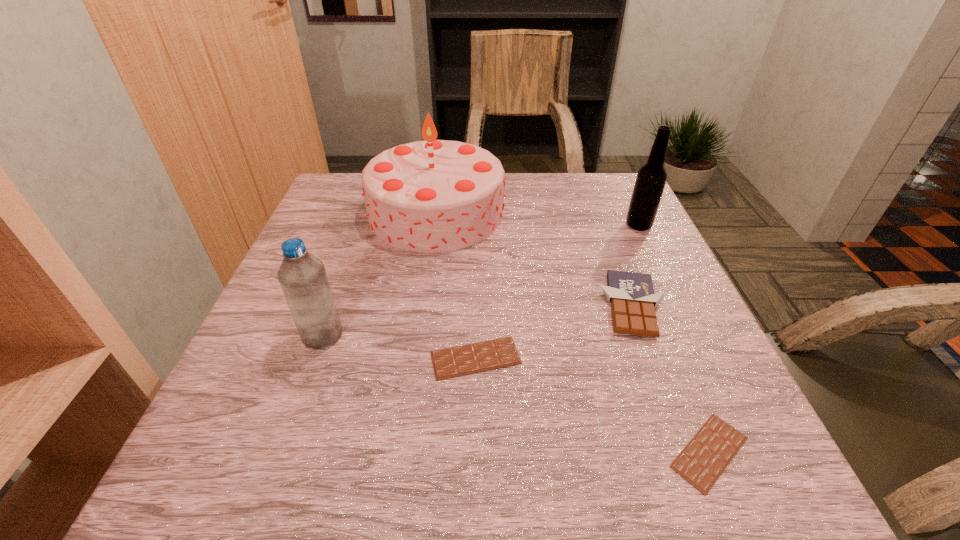
At what (x,y) coordinates should I click in order to perform the action: click on vacant area that lies between the nearest object and the tallest chocolate bar. Please return your answer as a coordinate pair (x, y). Looking at the image, I should click on (671, 379).

Locate an element on the screen. The height and width of the screenshot is (540, 960). free space between the fourth tallest object and the water bottle is located at coordinates (478, 321).

Find the location of a particular element. Image resolution: width=960 pixels, height=540 pixels. empty location between the beer bottle and the third shortest object is located at coordinates (636, 266).

Identify the location of vacant space that's between the beer bottle and the nearest chocolate bar. This screenshot has width=960, height=540. (674, 339).

This screenshot has width=960, height=540. Identify the location of unoccupied area between the birthday cake and the shortest chocolate bar. (573, 332).

The height and width of the screenshot is (540, 960). I want to click on free spot between the shortest chocolate bar and the leftmost chocolate bar, so click(592, 405).

Image resolution: width=960 pixels, height=540 pixels. I want to click on free space between the birthday cake and the shortest object, so click(573, 332).

Locate which object ranks fourth in proximity to the beer bottle. Please provide its 2D coordinates. Your answer should be formatted as a tuple, i.e. [(x, y)], where the tuple contains the x and y coordinates of a point satisfying the conditions above.

[(703, 460)]

The height and width of the screenshot is (540, 960). I want to click on object that stands as the second closest to the leftmost chocolate bar, so click(x=633, y=300).

You are a GUI agent. You are given a task and a screenshot of the screen. Output one action in this format:
    pyautogui.click(x=<x>, y=<y>)
    Task: Click on the chocolate bar that stands as the second closest to the leftmost chocolate bar
    This screenshot has width=960, height=540.
    Given the screenshot: What is the action you would take?
    pyautogui.click(x=703, y=460)